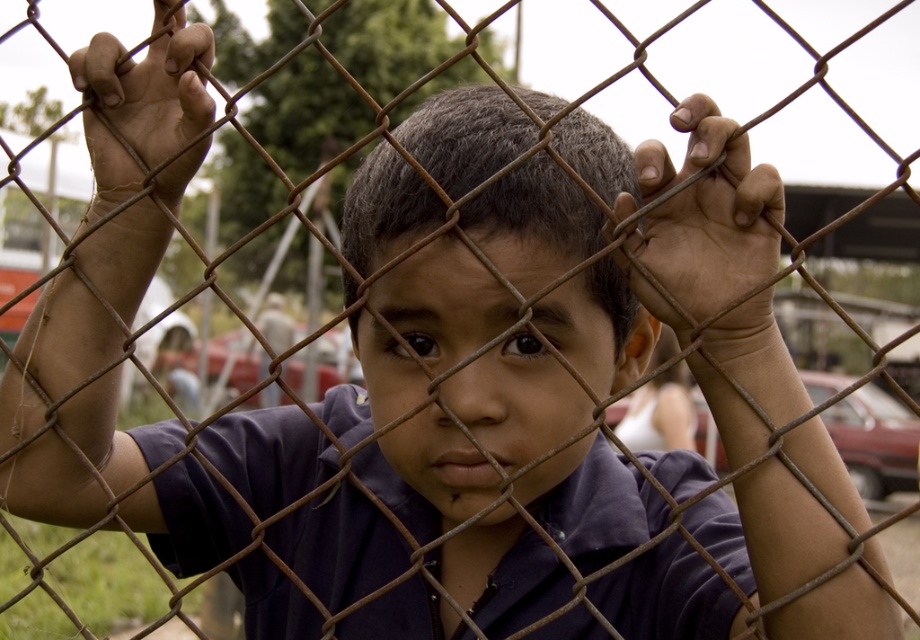
You are a photographer trying to capture the boy in the center wearing the matte purple shirt at center. To ensure the shirt is in focus, where should you aim your camera lens? Provide the coordinates as a point in the format of point followed by the numbers in parentheses.

The matte purple shirt at center is located at point (x=519, y=163). Therefore, you should aim your camera lens at point (x=519, y=163).

The boy is trying to reach a butterfly that landed on the brown rough wire at center. If the boy can stretch his arms 24 inches, will he be able to touch the butterfly?

The distance between the boy and the brown rough wire at center is 25.26 inches. Since the boy can only stretch his arms 24 inches, he cannot reach the butterfly on the brown rough wire at center.